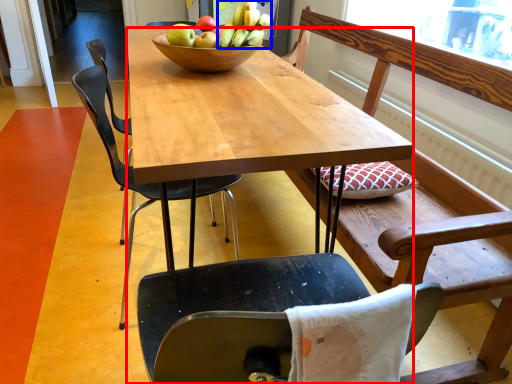
Question: Which object appears farthest to the camera in this image, desk (highlighted by a red box) or banana (highlighted by a blue box)?

Choices:
 (A) desk
 (B) banana

Answer: (B)